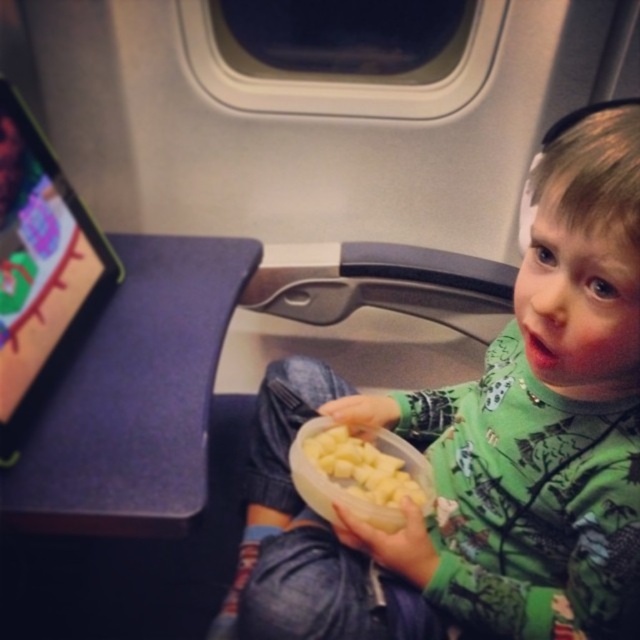
You are a flight attendant checking the seating area of the airplane cabin. You notice the green matte shirt at center and the yellow matte potato at center. Which object is located to the left of the other?

The yellow matte potato at center is located to the left of the green matte shirt at center because the green matte shirt at center is positioned on the right side of the yellow matte potato at center.

You are a flight attendant on an airplane. You need to hand a passenger a yellow matte potato at center. The passenger is wearing a green matte shirt at center. Can you reach the potato without moving the tray table?

The green matte shirt at center is 5.70 inches from yellow matte potato at center, so yes, the flight attendant can reach the yellow matte potato at center without moving the tray table since it is within a reachable distance.

You are sitting in an airplane seat and want to reach for something. There are two points in front of you labeled as point 1 and point 2. Point 1 is at coordinate (557, 428) and point 2 is at (413, 465). Based on your current position, which point is closer to you?

Point 1 at coordinate (557, 428) is closer to the viewer than point 2 at (413, 465).